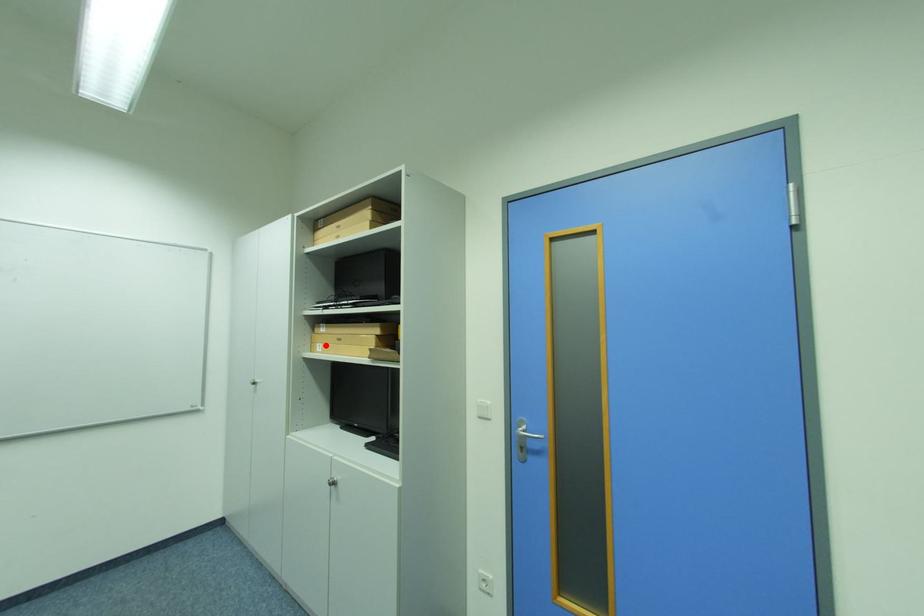
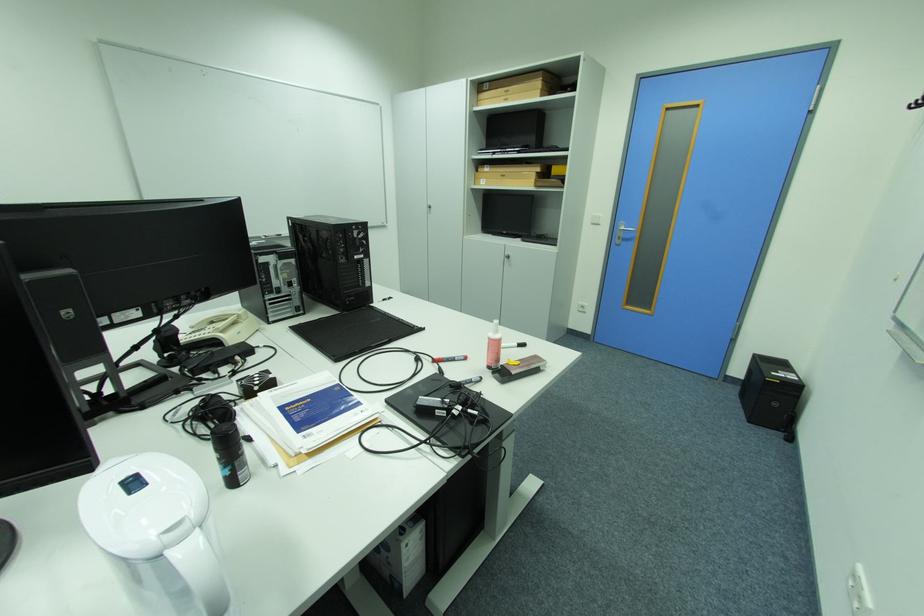
In the second image, find the point that corresponds to the highlighted location in the first image.

(490, 180)